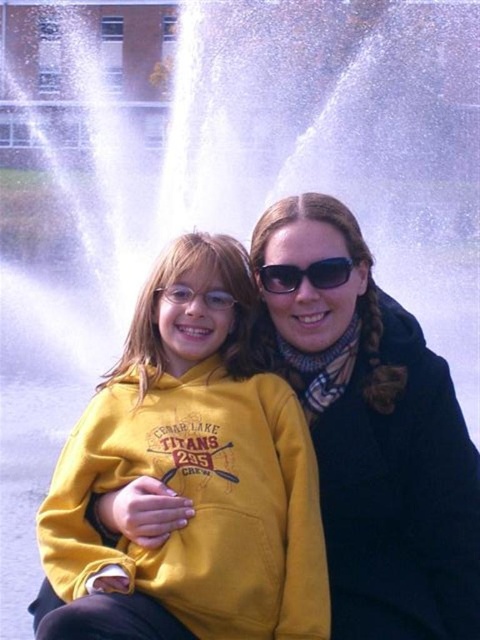
Who is taller, yellow fleece hoodie at center or black plastic sunglasses at center?

With more height is yellow fleece hoodie at center.

Who is more distant from viewer, (244, 451) or (279, 280)?

The point (279, 280) is behind.

Is point (177, 428) more distant than point (262, 268)?

No, (177, 428) is in front of (262, 268).

Locate an element on the screen. This screenshot has height=640, width=480. yellow fleece hoodie at center is located at coordinates (197, 464).

Which is more to the right, yellow fleece hoodie at center or matte black jacket at center?

Positioned to the right is matte black jacket at center.

Is yellow fleece hoodie at center taller than matte black jacket at center?

No, yellow fleece hoodie at center is not taller than matte black jacket at center.

Between point (267, 508) and point (346, 317), which one is positioned behind?

The point (346, 317) is more distant.

Where is `yellow fleece hoodie at center`? yellow fleece hoodie at center is located at coordinates (197, 464).

Measure the distance between matte black jacket at center and camera.

32.43 meters

The width and height of the screenshot is (480, 640). I want to click on matte black jacket at center, so click(375, 436).

The height and width of the screenshot is (640, 480). Find the location of `matte black jacket at center`. matte black jacket at center is located at coordinates (375, 436).